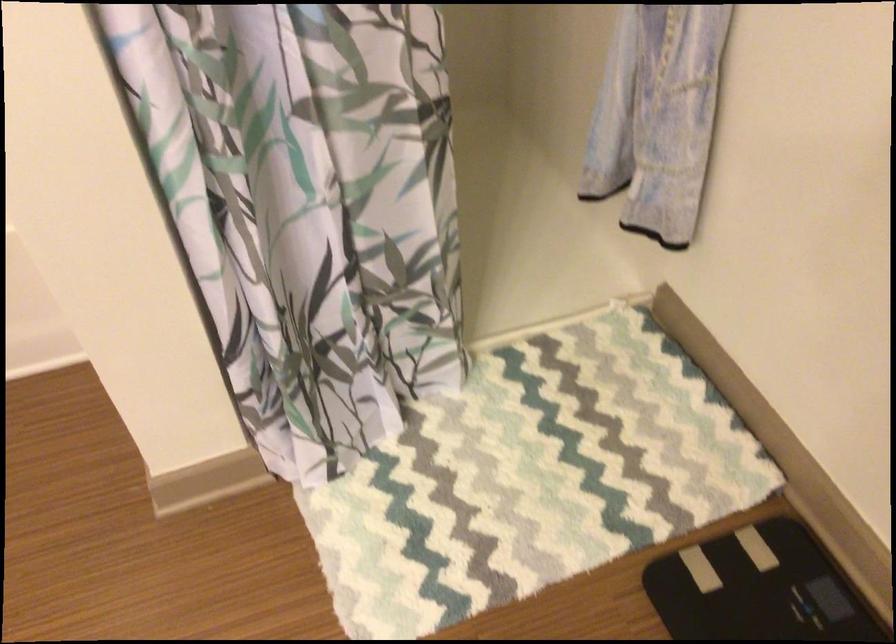
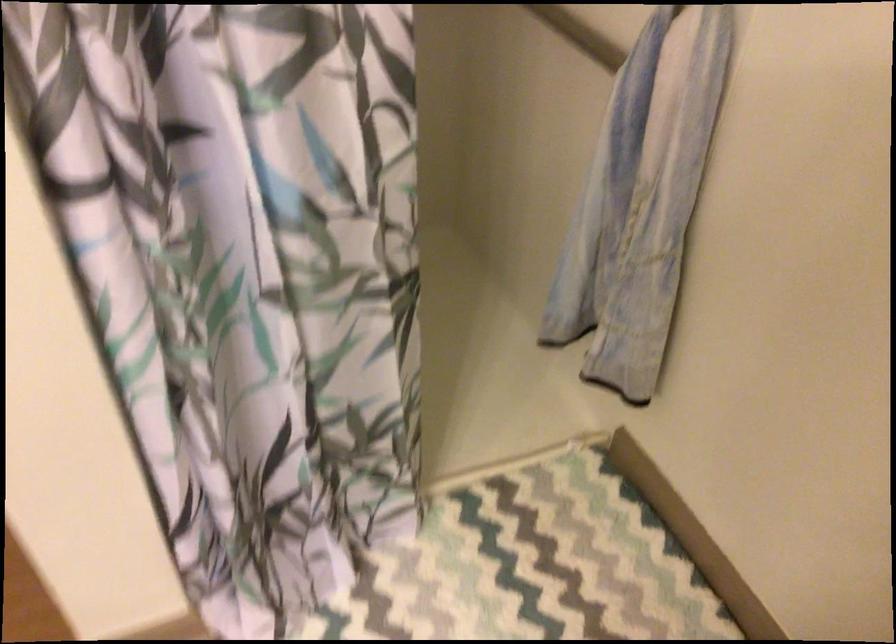
Question: The camera is either moving clockwise (left) or counter-clockwise (right) around the object. The first image is from the beginning of the video and the second image is from the end. Is the camera moving left or right when shooting the video?

Choices:
 (A) Left
 (B) Right

Answer: (A)